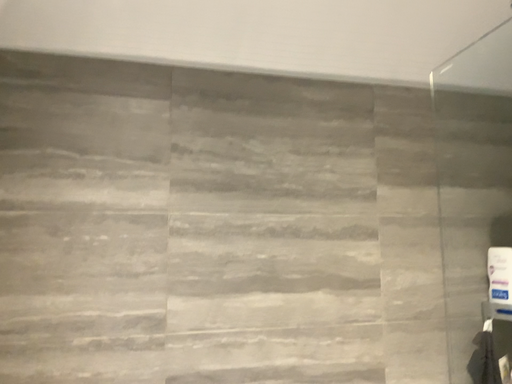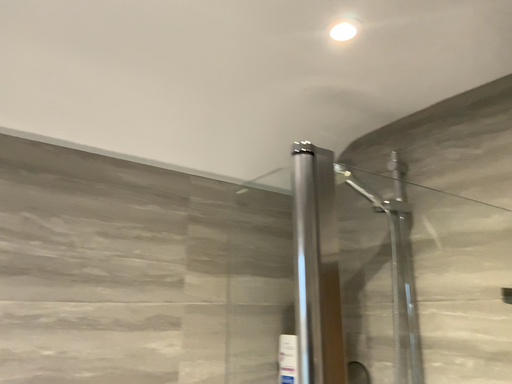
Question: Which way did the camera rotate in the video?

Choices:
 (A) rotated left
 (B) rotated right

Answer: (B)